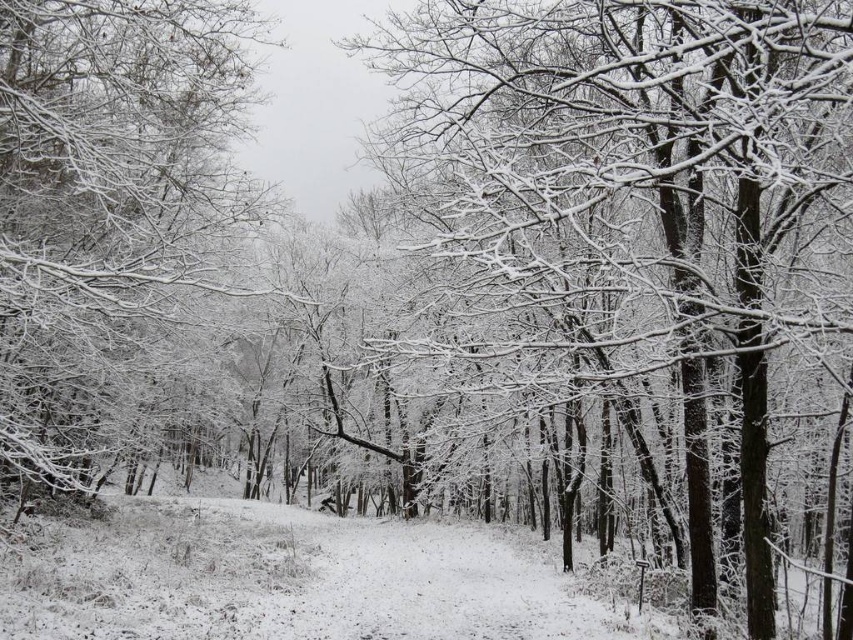
Question: Which point is farther to the camera?

Choices:
 (A) snow-covered branches at center
 (B) white frosty branches at left

Answer: (B)

Question: Which object is closer to the camera taking this photo?

Choices:
 (A) snow-covered branches at center
 (B) white frosty branches at left

Answer: (A)

Question: Does snow-covered branches at center appear under white frosty branches at left?

Choices:
 (A) no
 (B) yes

Answer: (B)

Question: Which of the following is the farthest from the observer?

Choices:
 (A) (451, 241)
 (B) (12, 184)

Answer: (B)

Question: Does snow-covered branches at center come in front of white frosty branches at left?

Choices:
 (A) yes
 (B) no

Answer: (A)

Question: Does snow-covered branches at center have a lesser width compared to white frosty branches at left?

Choices:
 (A) no
 (B) yes

Answer: (B)